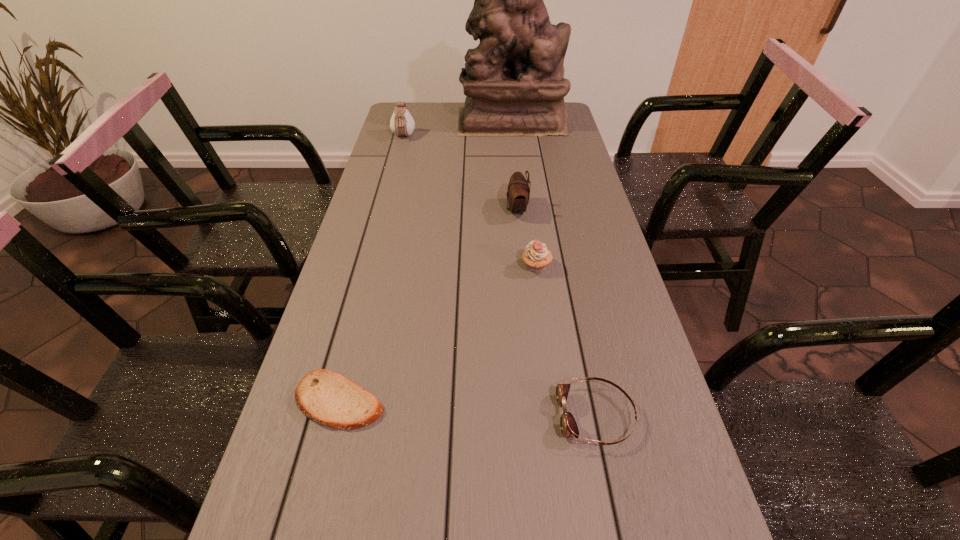
Identify the location of the fifth closest object to the pita bread. This screenshot has height=540, width=960. (514, 81).

Identify which object is located as the fifth nearest to the left pouch. Please provide its 2D coordinates. Your answer should be formatted as a tuple, i.e. [(x, y)], where the tuple contains the x and y coordinates of a point satisfying the conditions above.

[(568, 425)]